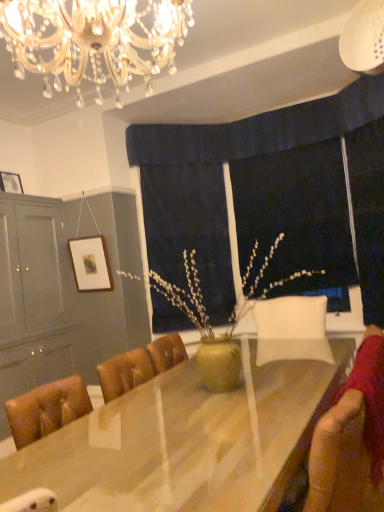
Question: Is wooden framed picture at upper left, acting as the second picture frame starting from the right, bigger than wooden picture frame at upper left, which ranks as the first picture frame in right-to-left order?

Choices:
 (A) yes
 (B) no

Answer: (B)

Question: Does wooden framed picture at upper left, which is the 2th picture frame in bottom-to-top order, have a smaller size compared to wooden picture frame at upper left, acting as the 2th picture frame starting from the top?

Choices:
 (A) no
 (B) yes

Answer: (B)

Question: From a real-world perspective, is wooden framed picture at upper left, which is the 2th picture frame in bottom-to-top order, over wooden picture frame at upper left, positioned as the 2th picture frame in left-to-right order?

Choices:
 (A) no
 (B) yes

Answer: (B)

Question: Is wooden framed picture at upper left, which is the 2th picture frame in bottom-to-top order, at the right side of wooden picture frame at upper left, which ranks as the first picture frame in bottom-to-top order?

Choices:
 (A) no
 (B) yes

Answer: (A)

Question: From the image's perspective, is wooden framed picture at upper left, acting as the second picture frame starting from the right, on wooden picture frame at upper left, which ranks as the first picture frame in bottom-to-top order?

Choices:
 (A) yes
 (B) no

Answer: (A)

Question: From a real-world perspective, is wooden framed picture at upper left, which is the 2th picture frame in bottom-to-top order, physically below wooden picture frame at upper left, which ranks as the first picture frame in bottom-to-top order?

Choices:
 (A) no
 (B) yes

Answer: (A)

Question: Can you confirm if black fabric at center is bigger than crystal glass chandelier at upper center?

Choices:
 (A) no
 (B) yes

Answer: (A)

Question: Is black fabric at center to the right of crystal glass chandelier at upper center from the viewer's perspective?

Choices:
 (A) no
 (B) yes

Answer: (B)

Question: From the image's perspective, is black fabric at center located above crystal glass chandelier at upper center?

Choices:
 (A) yes
 (B) no

Answer: (B)

Question: Is black fabric at center positioned with its back to crystal glass chandelier at upper center?

Choices:
 (A) yes
 (B) no

Answer: (B)

Question: Does black fabric at center have a smaller size compared to crystal glass chandelier at upper center?

Choices:
 (A) no
 (B) yes

Answer: (B)

Question: Is black fabric at center outside of crystal glass chandelier at upper center?

Choices:
 (A) yes
 (B) no

Answer: (A)

Question: Is wooden framed picture at upper left, the first picture frame positioned from the left, aimed at matte gray cabinet at left?

Choices:
 (A) yes
 (B) no

Answer: (B)